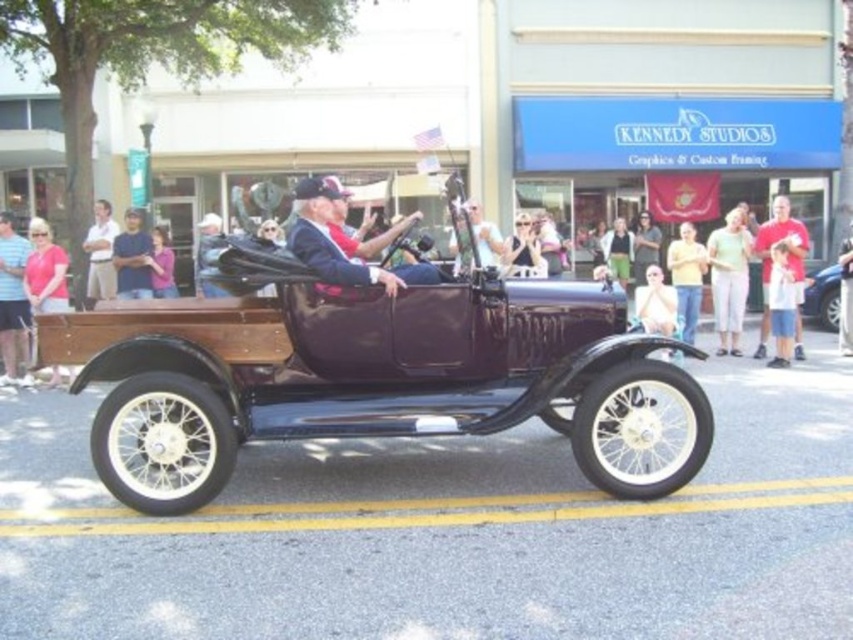
What do you see at coordinates (770, 259) in the screenshot? I see `red cotton shirt at right` at bounding box center [770, 259].

This screenshot has height=640, width=853. Find the location of `red cotton shirt at right`. red cotton shirt at right is located at coordinates (770, 259).

Looking at this image, who is more distant from viewer, (799,282) or (33,252)?

The point (799,282) is behind.

Find the location of a particular element. The width and height of the screenshot is (853, 640). red cotton shirt at right is located at coordinates (770, 259).

Is point (45, 236) positioned behind point (813, 275)?

No, it is in front of (813, 275).

Describe the element at coordinates (45, 269) in the screenshot. I see `matte pink shirt at left` at that location.

This screenshot has height=640, width=853. What are the coordinates of `matte pink shirt at left` in the screenshot? It's located at (45, 269).

Between shiny blue car at center and matte black camera at center, which one is positioned higher?

matte black camera at center

How distant is shiny blue car at center from matte black camera at center?

shiny blue car at center is 5.43 meters away from matte black camera at center.

In order to click on shiny blue car at center in this screenshot , I will do `click(822, 298)`.

Where is `shiny blue car at center`? The height and width of the screenshot is (640, 853). shiny blue car at center is located at coordinates (822, 298).